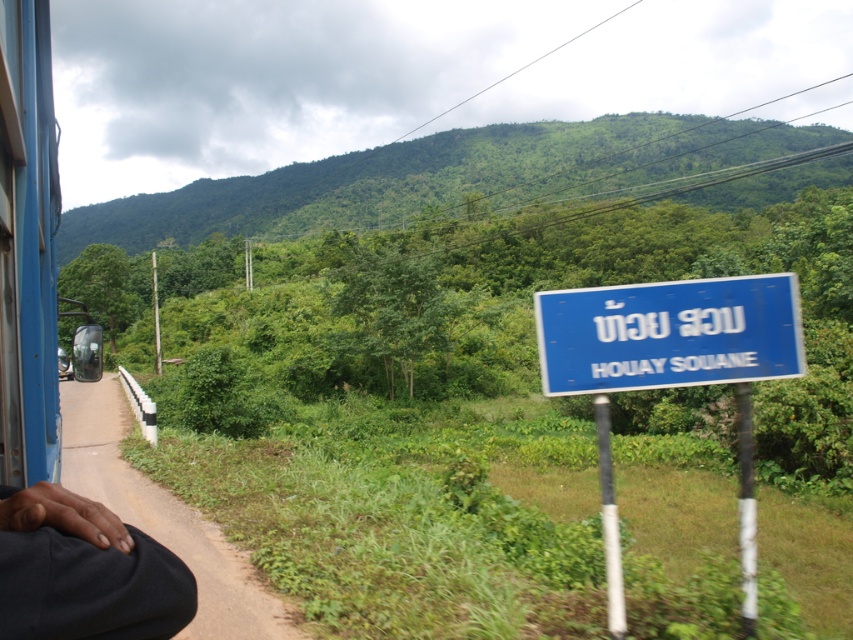
Question: Can you confirm if blue plastic sign at center is wider than blue plastic sign at center-right?

Choices:
 (A) yes
 (B) no

Answer: (A)

Question: In this image, where is dark blue fabric at lower left located relative to transparent glass train window at left?

Choices:
 (A) above
 (B) below

Answer: (A)

Question: Among these objects, which one is nearest to the camera?

Choices:
 (A) dark blue fabric at lower left
 (B) blue plastic sign at center-right

Answer: (A)

Question: Can you confirm if dark blue fabric at lower left is positioned to the left of transparent glass train window at left?

Choices:
 (A) no
 (B) yes

Answer: (A)

Question: Which object is the farthest from the transparent glass train window at left?

Choices:
 (A) dark blue fabric at lower left
 (B) blue plastic sign at center
 (C) blue plastic sign at center-right

Answer: (B)

Question: Which of the following is the farthest from the observer?

Choices:
 (A) transparent glass train window at left
 (B) blue plastic sign at center-right

Answer: (A)